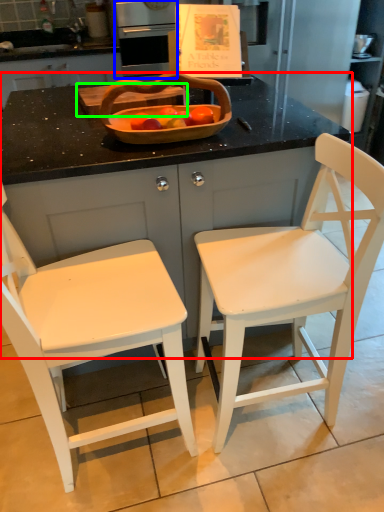
Question: Which is farther away from counter (highlighted by a red box)? kitchen appliance (highlighted by a blue box) or cutting board (highlighted by a green box)?

Choices:
 (A) kitchen appliance
 (B) cutting board

Answer: (A)